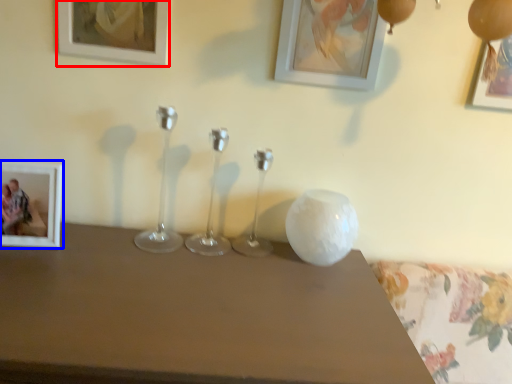
Question: Which object appears closest to the camera in this image, picture frame (highlighted by a red box) or picture frame (highlighted by a blue box)?

Choices:
 (A) picture frame
 (B) picture frame

Answer: (A)